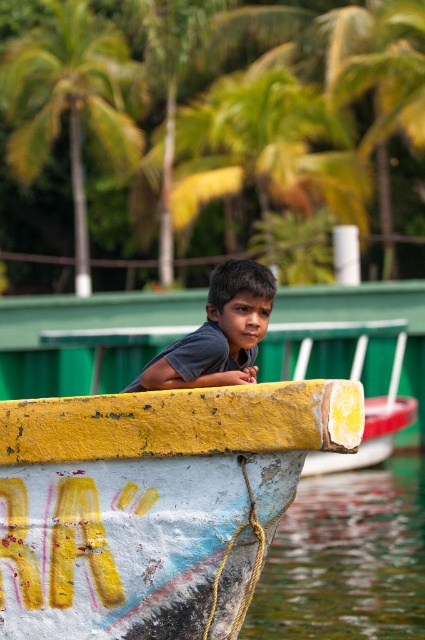
You are a safety inspector checking the safety of the yellow painted wood boat at center. The safety regulations state that the boat must be at least 6 meters away from the transparent water at lower left to prevent accidental drifting. Based on the scene, is the boat compliant with the safety regulations?

The distance between the yellow painted wood boat at center and the transparent water at lower left is 5.06 meters, which is less than the required 6 meters. Therefore, the boat is not compliant with the safety regulations.